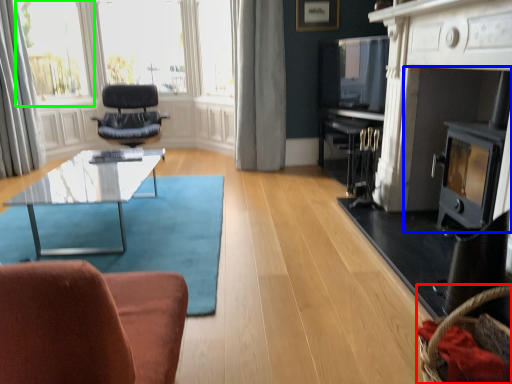
Question: Which object is the farthest from basket (highlighted by a red box)? Choose among these: fireplace (highlighted by a blue box) or bay window (highlighted by a green box).

Choices:
 (A) fireplace
 (B) bay window

Answer: (B)